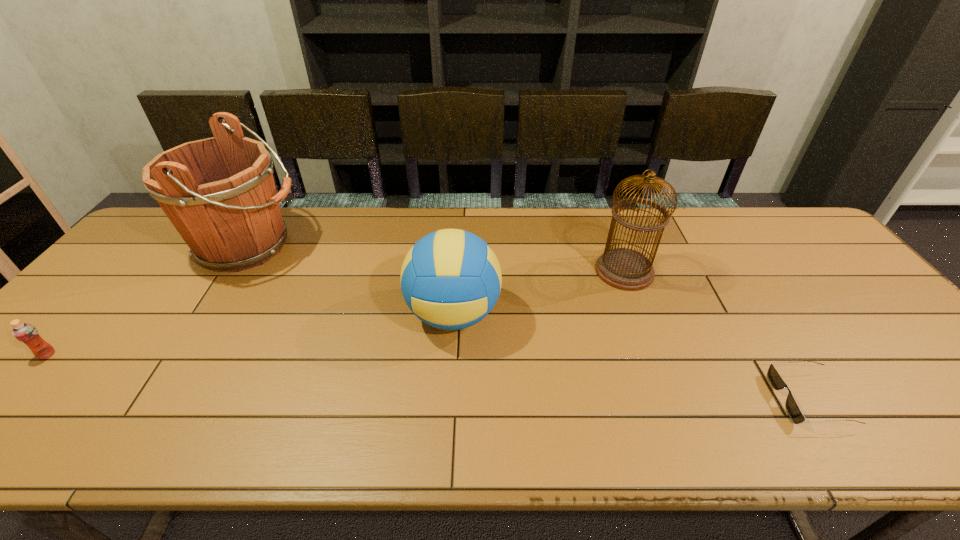
Identify the location of vacant region located on the front-facing side of the birdcage. (551, 271).

I want to click on vacant region located on the front-facing side of the birdcage, so click(x=513, y=271).

The height and width of the screenshot is (540, 960). Identify the location of free space located 0.180m on the front of the third object from right to left. (447, 419).

Where is `free space located 0.060m on the right of the orange juice`? This screenshot has width=960, height=540. free space located 0.060m on the right of the orange juice is located at coordinates (80, 354).

The image size is (960, 540). I want to click on vacant space located 0.100m on the front-facing side of the shortest object, so click(733, 399).

What are the coordinates of `blank space located on the front-facing side of the shortest object` in the screenshot? It's located at (715, 399).

Find the location of a particular element. Image resolution: width=960 pixels, height=540 pixels. free region located 0.200m on the front-facing side of the shortest object is located at coordinates (687, 399).

At what (x,y) coordinates should I click in order to perform the action: click on object positioned at the far edge. Please return your answer as a coordinate pair (x, y). Looking at the image, I should click on (219, 193).

Image resolution: width=960 pixels, height=540 pixels. I want to click on object present at the near edge, so click(x=792, y=408).

Find the location of a particular element. The height and width of the screenshot is (540, 960). object that is positioned at the left edge is located at coordinates (28, 334).